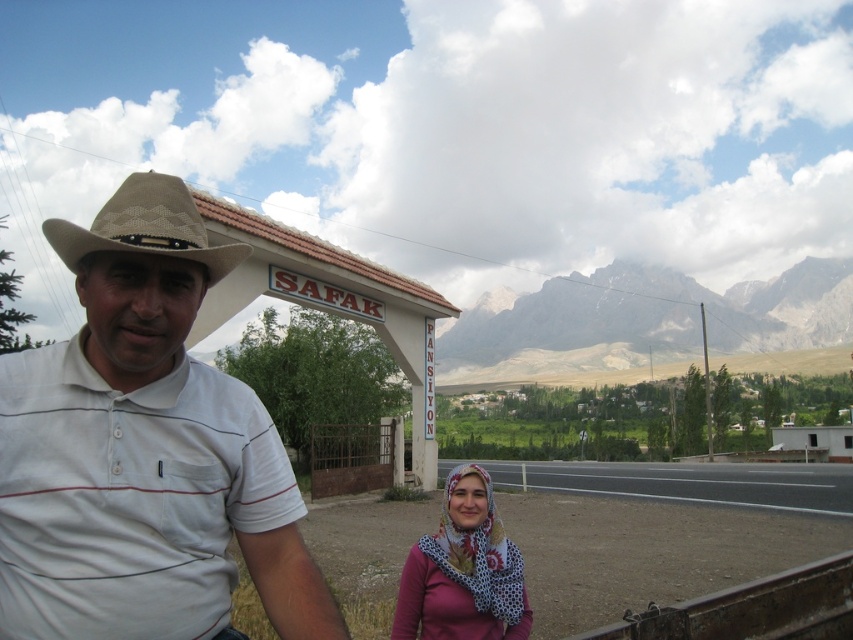
You are standing at the point marked as point (x=645, y=320) in the image. What object is located at this coordinate?

The rugged stone mountain at upper center is located at point (x=645, y=320).

You are a photographer trying to capture both the tan woven cowboy hat at left and the printed cotton scarf at lower center in a single frame. Which object should you focus on first to ensure both are in the shot?

The tan woven cowboy hat at left is located above the printed cotton scarf at lower center, so you should focus on the printed cotton scarf at lower center first to ensure both are in the frame.

You are a photographer trying to capture both the tan woven cowboy hat at left and the printed cotton scarf at lower center in the same frame. Which object should you focus on first to ensure both are in the frame?

The tan woven cowboy hat at left is bigger than the printed cotton scarf at lower center, so you should focus on the tan woven cowboy hat at left first to ensure both are in the frame.